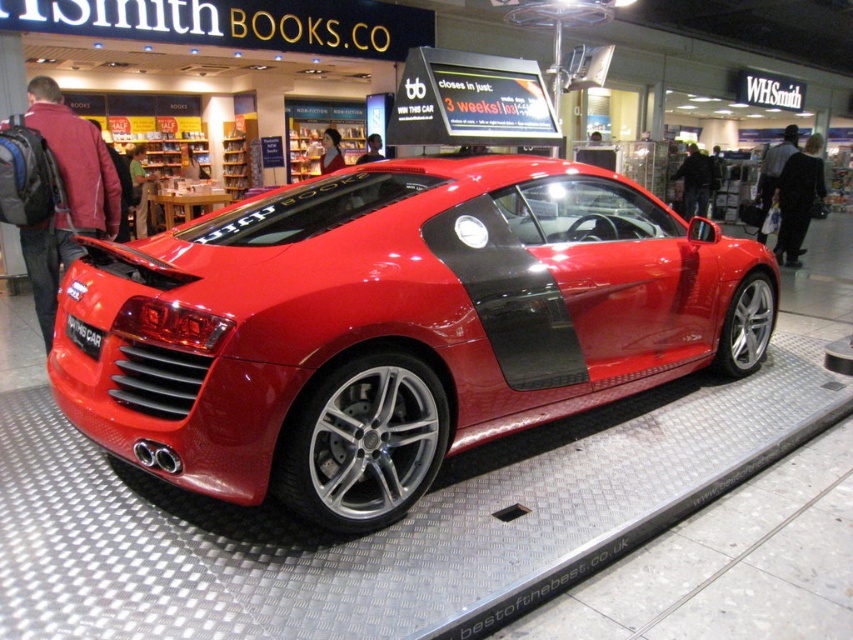
You are a photographer planning to capture the shiny red sports car at center and the black matte license plate at center in a single frame. Given that the camera can only focus on objects within a 1.5 meter width, will both objects fit in the frame?

The shiny red sports car at center is wider than the black matte license plate at center. Since the camera can only focus on objects within a 1.5 meter width, both objects will fit in the frame as long as their combined width does not exceed 1.5 meters. However, the description only states the car is wider than the license plate but does not provide exact measurements, so we cannot confirm if they fit without additional information.

You are a photographer trying to capture the shiny red sports car at center and the black matte license plate at center. Since you want to focus on the car, which object should you adjust your camera lens to prioritize in terms of distance?

The shiny red sports car at center is closer to the viewer than the black matte license plate at center, so you should adjust your camera lens to prioritize focusing on the shiny red sports car at center.